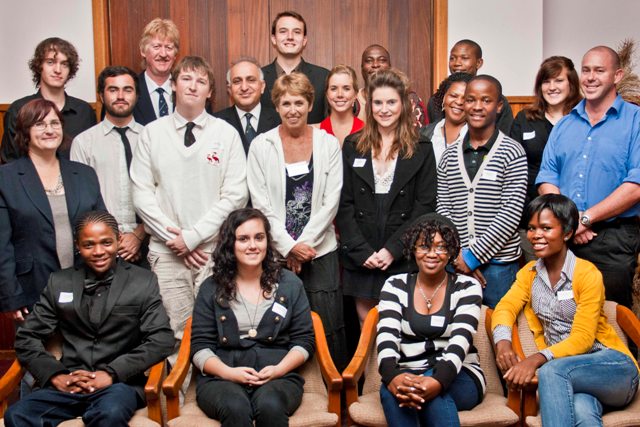
Find the location of `the back wall`. the back wall is located at coordinates (578, 32), (83, 30).